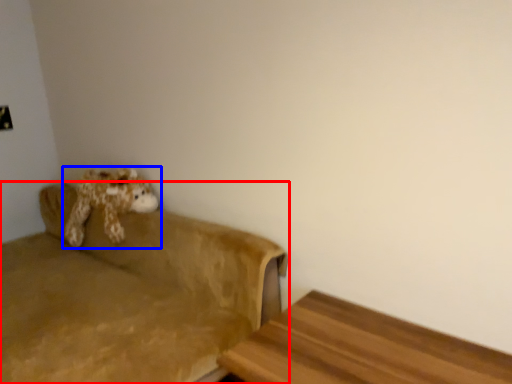
Question: Which point is further to the camera, studio couch (highlighted by a red box) or toy (highlighted by a blue box)?

Choices:
 (A) studio couch
 (B) toy

Answer: (B)